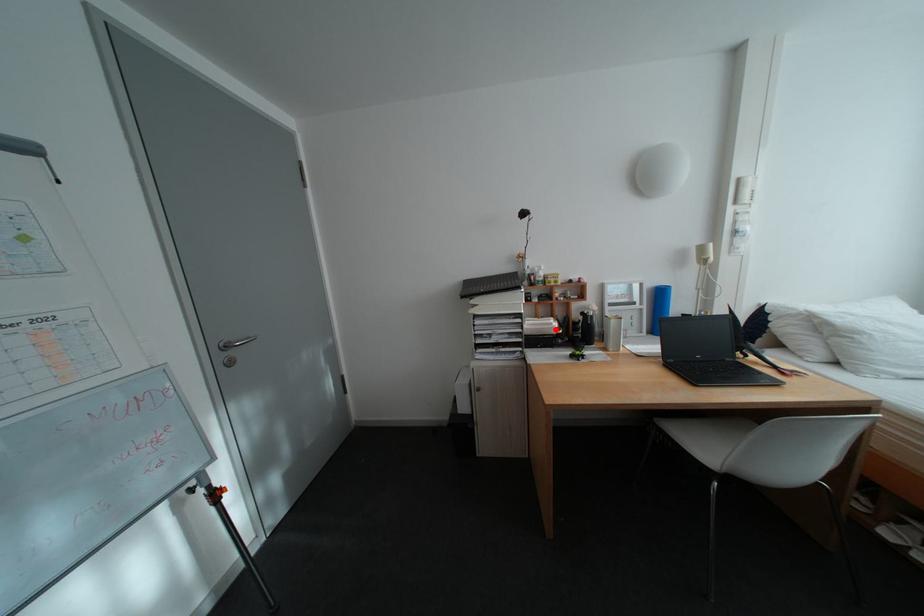
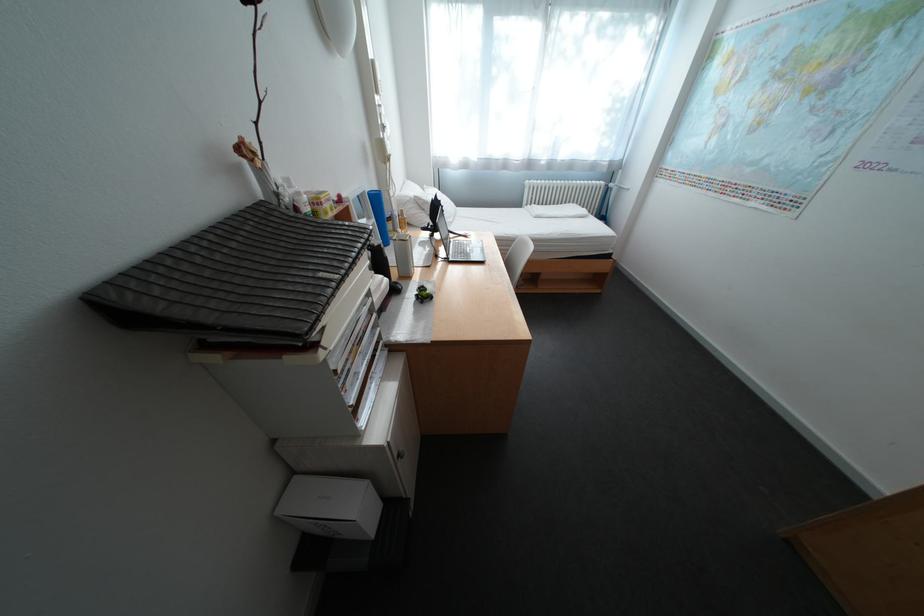
Question: I am providing you with two images of the same scene from different viewpoints. Given a red point in image1, look at the same physical point in image2. Is it:

Choices:
 (A) Closer to the viewpoint
 (B) Farther from the viewpoint

Answer: (A)